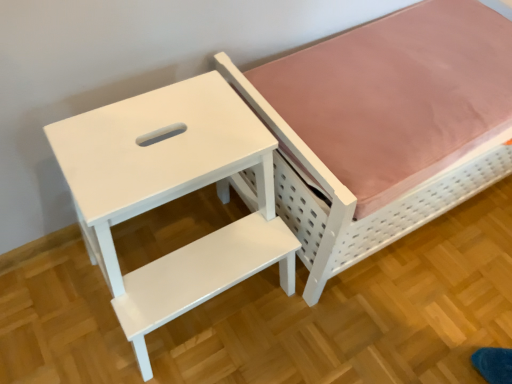
The height and width of the screenshot is (384, 512). Describe the element at coordinates (172, 196) in the screenshot. I see `white glossy step stool at upper left` at that location.

Measure the distance between white glossy step stool at upper left and camera.

white glossy step stool at upper left and camera are 26.95 inches apart.

This screenshot has height=384, width=512. Identify the location of white glossy step stool at upper left. (172, 196).

The height and width of the screenshot is (384, 512). Identify the location of white matte bed at upper right. (384, 127).

Describe the element at coordinates (384, 127) in the screenshot. The height and width of the screenshot is (384, 512). I see `white matte bed at upper right` at that location.

Identify the location of white glossy step stool at upper left. coord(172,196).

Is white glossy step stool at upper left to the left or to the right of white matte bed at upper right in the image?

white glossy step stool at upper left is to the left of white matte bed at upper right.

Does white glossy step stool at upper left come in front of white matte bed at upper right?

Yes, it is in front of white matte bed at upper right.

Which point is more distant from viewer, (261, 127) or (377, 97)?

The point (377, 97) is farther from the camera.

From the image's perspective, between white glossy step stool at upper left and white matte bed at upper right, who is located below?

white glossy step stool at upper left.

From a real-world perspective, is white glossy step stool at upper left positioned above or below white matte bed at upper right?

white glossy step stool at upper left is situated higher than white matte bed at upper right in the real world.

Considering the sizes of objects white glossy step stool at upper left and white matte bed at upper right in the image provided, who is wider, white glossy step stool at upper left or white matte bed at upper right?

Wider between the two is white matte bed at upper right.

Who is taller, white glossy step stool at upper left or white matte bed at upper right?

white glossy step stool at upper left is taller.

Considering the relative sizes of white glossy step stool at upper left and white matte bed at upper right in the image provided, is white glossy step stool at upper left smaller than white matte bed at upper right?

Indeed, white glossy step stool at upper left has a smaller size compared to white matte bed at upper right.

Based on the photo, is white glossy step stool at upper left spatially inside white matte bed at upper right, or outside of it?

white glossy step stool at upper left is outside white matte bed at upper right.

Is white glossy step stool at upper left directly adjacent to white matte bed at upper right?

white glossy step stool at upper left is not next to white matte bed at upper right, and they're not touching.

Is white glossy step stool at upper left facing towards white matte bed at upper right?

No, white glossy step stool at upper left is not aimed at white matte bed at upper right.

What's the angular difference between white glossy step stool at upper left and white matte bed at upper right's facing directions?

The angle between the facing direction of white glossy step stool at upper left and the facing direction of white matte bed at upper right is 2.29 degrees.

What are the coordinates of `table lying on the left of white matte bed at upper right` in the screenshot? It's located at (172, 196).

Between white matte bed at upper right and white glossy step stool at upper left, which one appears on the right side from the viewer's perspective?

Positioned to the right is white matte bed at upper right.

Is the position of white matte bed at upper right less distant than that of white glossy step stool at upper left?

No, it is not.

Which is less distant, (306,121) or (151,301)?

Point (306,121) is positioned farther from the camera compared to point (151,301).

From the image's perspective, which is below, white matte bed at upper right or white glossy step stool at upper left?

white glossy step stool at upper left.

From a real-world perspective, between white matte bed at upper right and white glossy step stool at upper left, who is vertically lower?

In real-world perspective, white matte bed at upper right is lower.

Considering the relative sizes of white matte bed at upper right and white glossy step stool at upper left in the image provided, is white matte bed at upper right thinner than white glossy step stool at upper left?

Incorrect, the width of white matte bed at upper right is not less than that of white glossy step stool at upper left.

Considering the sizes of objects white matte bed at upper right and white glossy step stool at upper left in the image provided, who is taller, white matte bed at upper right or white glossy step stool at upper left?

white glossy step stool at upper left.

Can you confirm if white matte bed at upper right is smaller than white glossy step stool at upper left?

Incorrect, white matte bed at upper right is not smaller in size than white glossy step stool at upper left.

Can we say white matte bed at upper right lies outside white glossy step stool at upper left?

white matte bed at upper right lies outside white glossy step stool at upper left's area.

Is there a large distance between white matte bed at upper right and white glossy step stool at upper left?

No, there isn't a large distance between white matte bed at upper right and white glossy step stool at upper left.

Is white matte bed at upper right facing towards white glossy step stool at upper left?

No, white matte bed at upper right does not turn towards white glossy step stool at upper left.

What's the angular difference between white matte bed at upper right and white glossy step stool at upper left's facing directions?

They differ by 2.29 degrees in their facing directions.

Locate an element on the screen. The image size is (512, 384). furniture directly beneath the white glossy step stool at upper left (from a real-world perspective) is located at coordinates (384, 127).

At what (x,y) coordinates should I click in order to perform the action: click on table lying in front of the white matte bed at upper right. Please return your answer as a coordinate pair (x, y). Image resolution: width=512 pixels, height=384 pixels. Looking at the image, I should click on (172, 196).

Locate an element on the screen. furniture below the white glossy step stool at upper left (from a real-world perspective) is located at coordinates (384, 127).